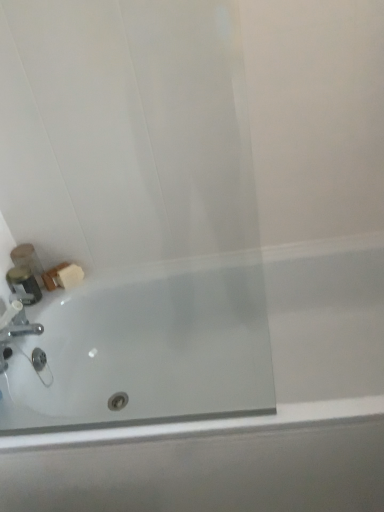
Question: Is silver metallic faucet at lower left far from white glossy bathtub at lower left?

Choices:
 (A) no
 (B) yes

Answer: (A)

Question: From the image's perspective, is silver metallic faucet at lower left under white glossy bathtub at lower left?

Choices:
 (A) no
 (B) yes

Answer: (A)

Question: Does silver metallic faucet at lower left have a greater width compared to white glossy bathtub at lower left?

Choices:
 (A) no
 (B) yes

Answer: (A)

Question: Does silver metallic faucet at lower left appear on the left side of white glossy bathtub at lower left?

Choices:
 (A) no
 (B) yes

Answer: (B)

Question: Is silver metallic faucet at lower left oriented towards white glossy bathtub at lower left?

Choices:
 (A) yes
 (B) no

Answer: (B)

Question: Is silver metallic faucet at lower left placed right next to white glossy bathtub at lower left?

Choices:
 (A) yes
 (B) no

Answer: (B)

Question: Is silver metallic faucet at lower left next to metallic silver container at left, the 1th toiletry when ordered from front to back, and touching it?

Choices:
 (A) yes
 (B) no

Answer: (B)

Question: Is silver metallic faucet at lower left oriented away from metallic silver container at left, the second toiletry positioned from the back?

Choices:
 (A) no
 (B) yes

Answer: (A)

Question: Would you say silver metallic faucet at lower left is outside metallic silver container at left, the second toiletry positioned from the back?

Choices:
 (A) no
 (B) yes

Answer: (B)

Question: Is silver metallic faucet at lower left oriented towards metallic silver container at left, the 1th toiletry when ordered from front to back?

Choices:
 (A) yes
 (B) no

Answer: (B)

Question: Is silver metallic faucet at lower left positioned far away from metallic silver container at left, the second toiletry positioned from the back?

Choices:
 (A) yes
 (B) no

Answer: (B)

Question: Can you confirm if silver metallic faucet at lower left is positioned to the left of metallic silver container at left, the 1th toiletry when ordered from front to back?

Choices:
 (A) yes
 (B) no

Answer: (B)

Question: From a real-world perspective, does white glossy bathtub at lower left stand above matte plastic soap at lower left, the 1th toiletry in the back-to-front sequence?

Choices:
 (A) no
 (B) yes

Answer: (A)